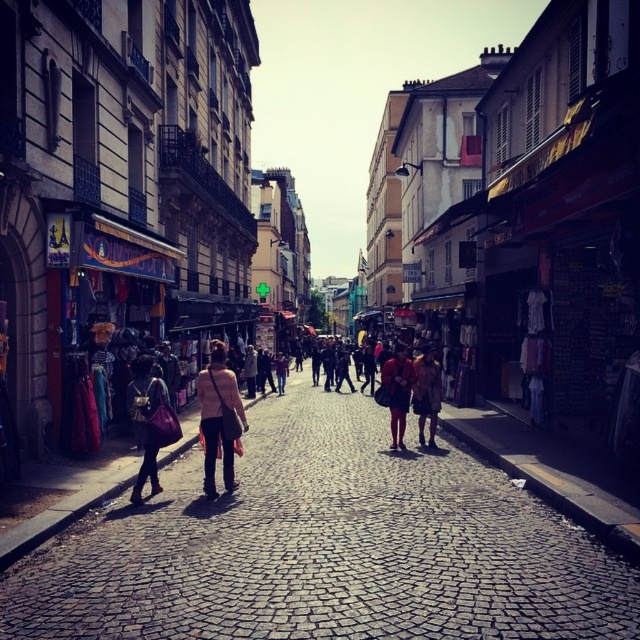
Question: Where is light pink fabric jacket at center located in relation to matte brown dress at center in the image?

Choices:
 (A) right
 (B) left

Answer: (B)

Question: Considering the real-world distances, which object is farthest from the matte pink bag at center?

Choices:
 (A) matte black dress at center
 (B) matte brown dress at center

Answer: (B)

Question: Estimate the real-world distances between objects in this image. Which object is closer to the cobblestone street at center?

Choices:
 (A) matte brown dress at center
 (B) light pink fabric jacket at center
 (C) matte black dress at center
 (D) matte pink bag at center

Answer: (D)

Question: Observing the image, what is the correct spatial positioning of cobblestone street at center in reference to matte black dress at center?

Choices:
 (A) below
 (B) above

Answer: (A)

Question: Among these objects, which one is nearest to the camera?

Choices:
 (A) matte brown dress at center
 (B) cobblestone street at center
 (C) light pink fabric jacket at center

Answer: (B)

Question: Does light pink fabric jacket at center come behind matte black dress at center?

Choices:
 (A) yes
 (B) no

Answer: (B)